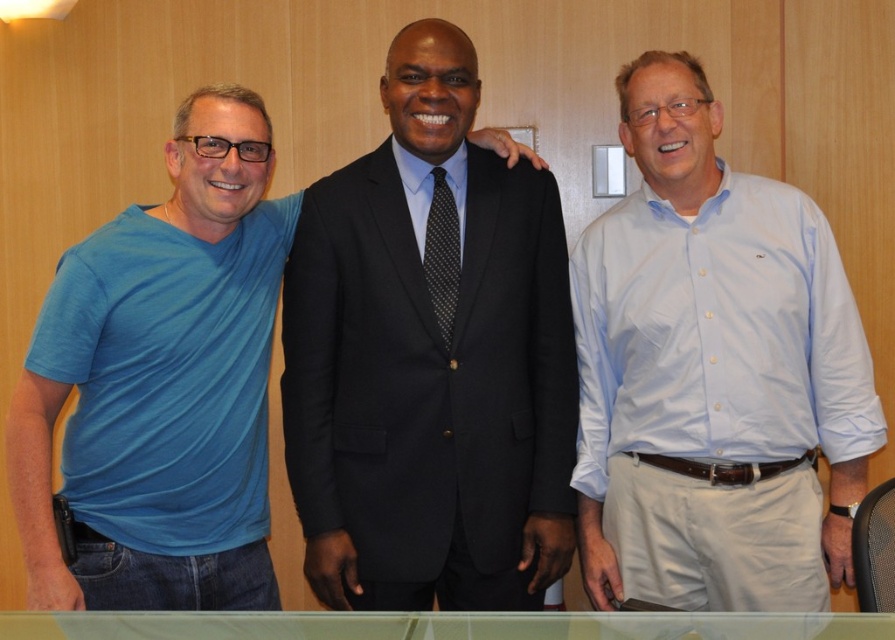
Which is behind, point (411, 330) or point (215, 102)?

Point (411, 330)

Which is behind, point (388, 156) or point (224, 252)?

The point (388, 156) is behind.

The width and height of the screenshot is (895, 640). I want to click on black wool suit at center, so click(428, 369).

Does black wool suit at center have a greater width compared to black dotted tie at center?

Indeed, black wool suit at center has a greater width compared to black dotted tie at center.

Can you confirm if black wool suit at center is taller than black dotted tie at center?

Yes, black wool suit at center is taller than black dotted tie at center.

What do you see at coordinates (428, 369) in the screenshot? I see `black wool suit at center` at bounding box center [428, 369].

Locate an element on the screen. black wool suit at center is located at coordinates (428, 369).

Between light blue button-down shirt at center and black wool suit at center, which one is positioned lower?

black wool suit at center is lower down.

Can you confirm if light blue button-down shirt at center is taller than black wool suit at center?

Correct, light blue button-down shirt at center is much taller as black wool suit at center.

Locate an element on the screen. The width and height of the screenshot is (895, 640). light blue button-down shirt at center is located at coordinates (712, 371).